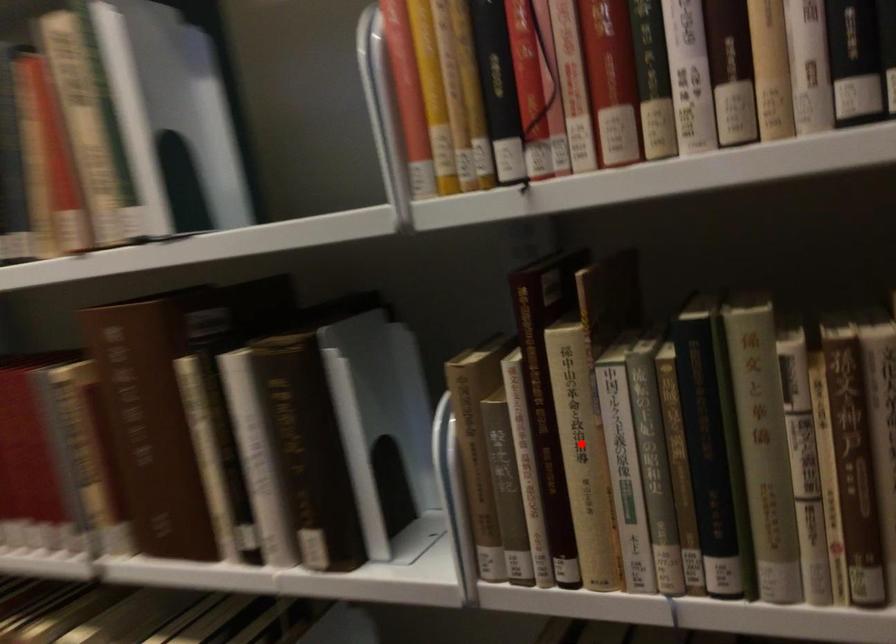
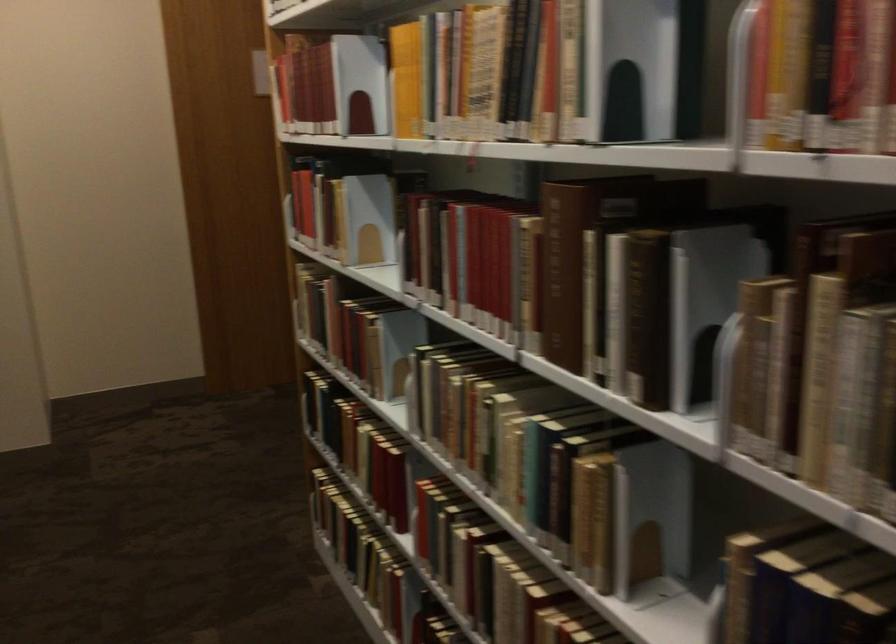
Find the pixel in the second image that matches the highlighted location in the first image.

(817, 366)